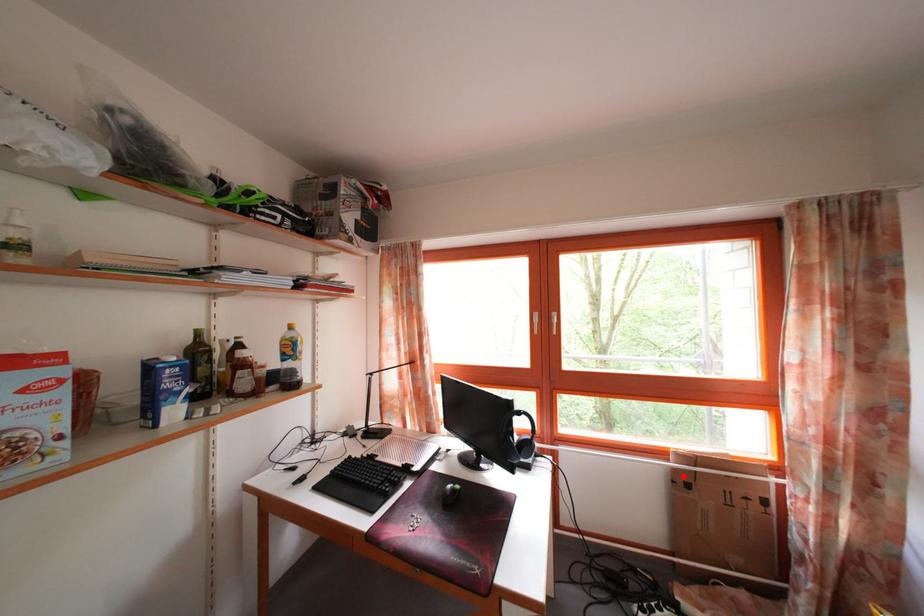
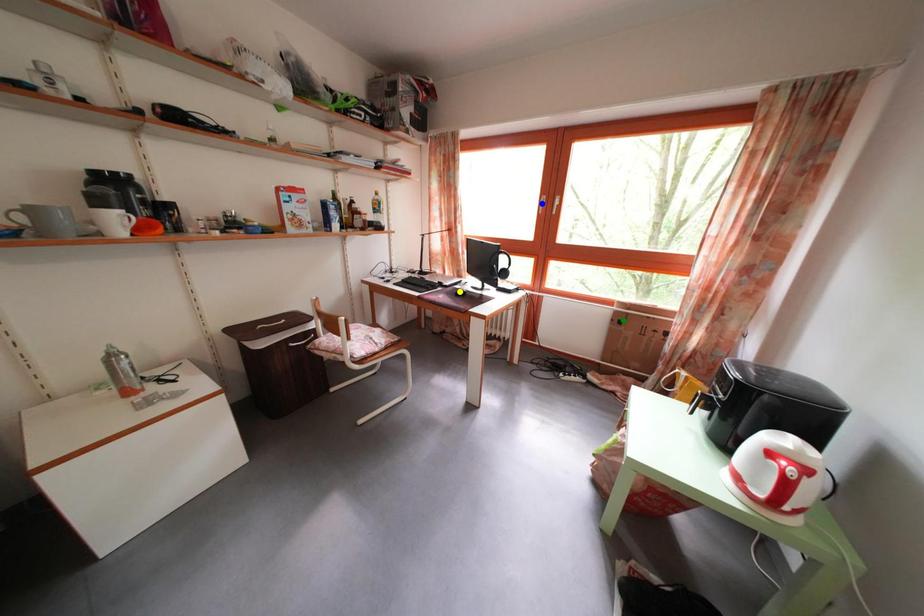
Question: I am providing you with two images of the same scene from different viewpoints. A red point is marked on the first image. You are given multiple points on the second image. Which point in image 2 is actually the same real-world point as the red point in image 1?

Choices:
 (A) green point
 (B) yellow point
 (C) blue point

Answer: (A)